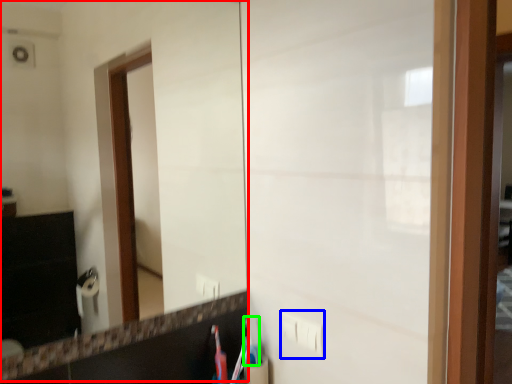
Question: Considering the real-world distances, which object is farthest from mirror (highlighted by a red box)? electric outlet (highlighted by a blue box) or toothbrush (highlighted by a green box)?

Choices:
 (A) electric outlet
 (B) toothbrush

Answer: (A)